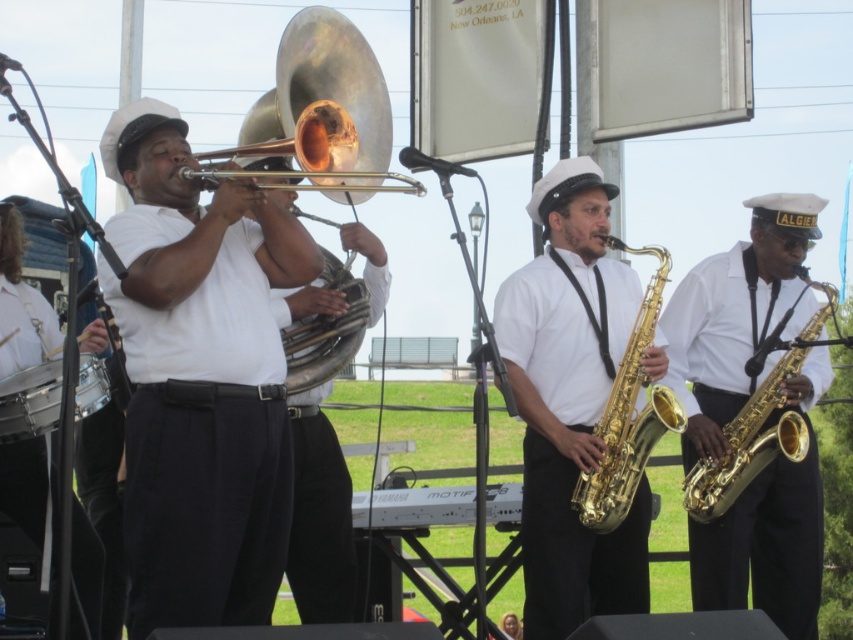
You are a photographer trying to capture the gold shiny trumpet at upper center and the gold shiny saxophone at right in the same frame. Which instrument should you adjust your camera angle to include first if you want to ensure both are fully visible?

The gold shiny trumpet at upper center might be wider than the gold shiny saxophone at right, so you should adjust your camera angle to include the gold shiny trumpet at upper center first to ensure both are fully visible.

You are standing at the center of the park and want to place a small bench between the two points labeled as point 1 and point 2. The first point is point 1 at (259, 497) and the second point is point 2 at (688, 515). Which point should the bench be closer to if you want it to be closer to the front of the park?

The bench should be placed closer to point 1 at (259, 497) because it is in front of point 2 at (688, 515).

You are a photographer trying to capture a clear shot of both the gold shiny trumpet at upper center and the gold shiny saxophone at right. Which instrument will appear taller in your photo?

The gold shiny trumpet at upper center will appear taller in the photo since it is much taller than the gold shiny saxophone at right according to the description.